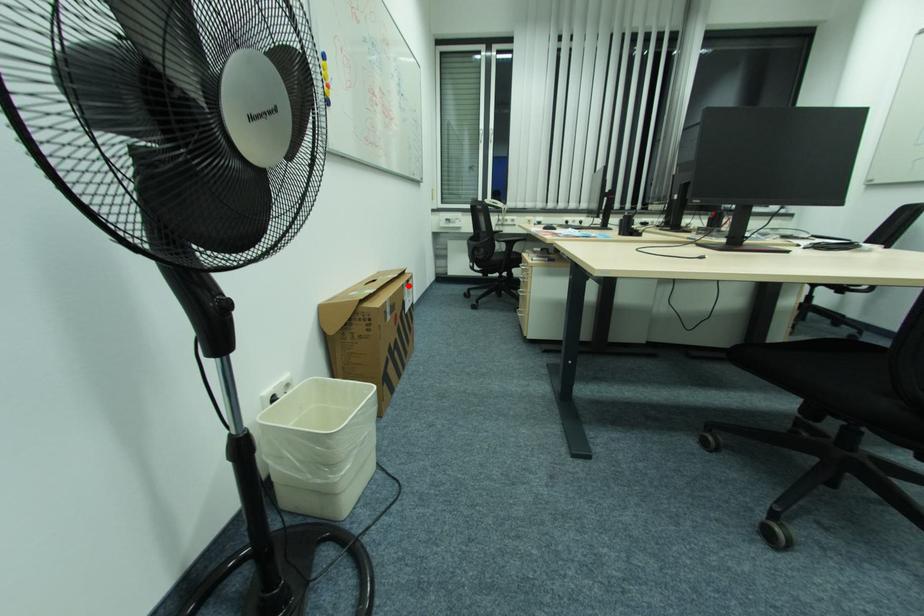
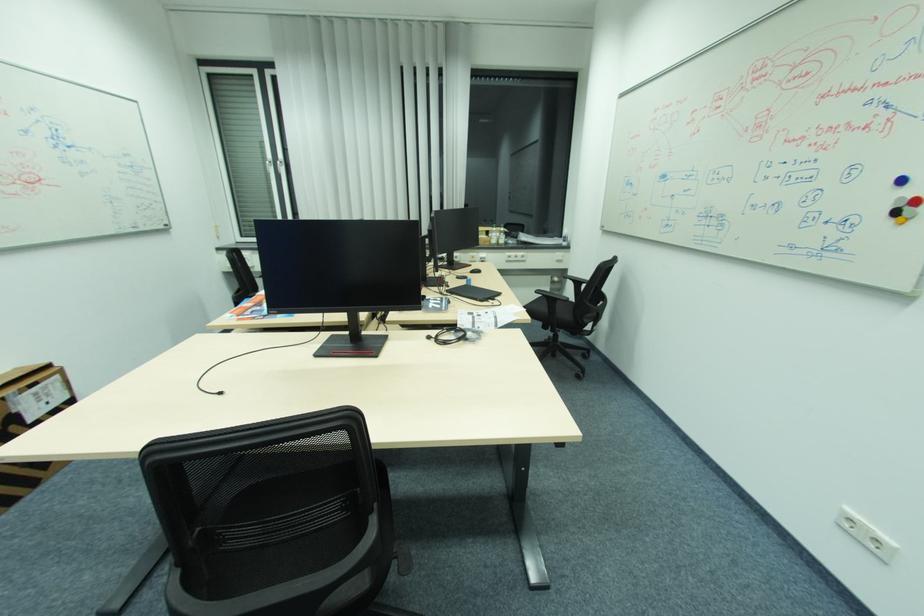
Question: I am providing you with two images of the same scene from different viewpoints. Given a red point in image1, look at the same physical point in image2. Is it:

Choices:
 (A) Closer to the viewpoint
 (B) Farther from the viewpoint

Answer: (B)